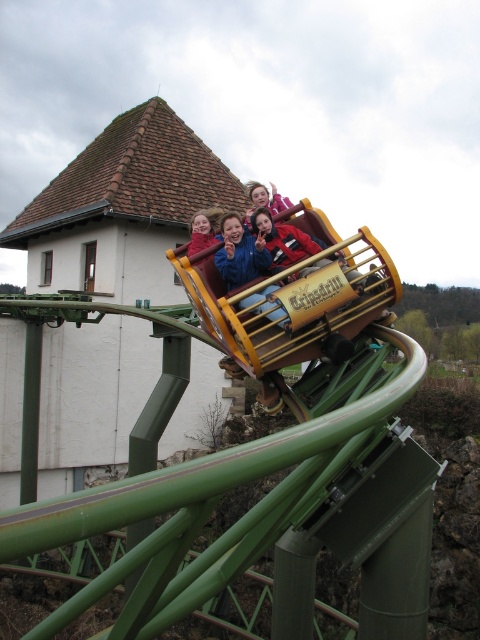
What do you see at coordinates (288, 294) in the screenshot?
I see `wooden roller coaster at center` at bounding box center [288, 294].

Is wooden roller coaster at center above blue denim jacket at upper center?

Actually, wooden roller coaster at center is below blue denim jacket at upper center.

Does point (277, 304) come farther from viewer compared to point (272, 214)?

That is False.

Locate an element on the screen. This screenshot has width=480, height=640. wooden roller coaster at center is located at coordinates (288, 294).

Who is shorter, wooden roller coaster at center or blue denim jacket at center?

blue denim jacket at center

The height and width of the screenshot is (640, 480). I want to click on wooden roller coaster at center, so click(x=288, y=294).

Where is `wooden roller coaster at center`? The width and height of the screenshot is (480, 640). wooden roller coaster at center is located at coordinates (288, 294).

Can you confirm if blue denim jacket at center is positioned above matte blue jacket at center?

Incorrect, blue denim jacket at center is not positioned above matte blue jacket at center.

Can you confirm if blue denim jacket at center is positioned to the right of matte blue jacket at center?

Yes, blue denim jacket at center is to the right of matte blue jacket at center.

In order to click on blue denim jacket at center in this screenshot , I will do `click(240, 253)`.